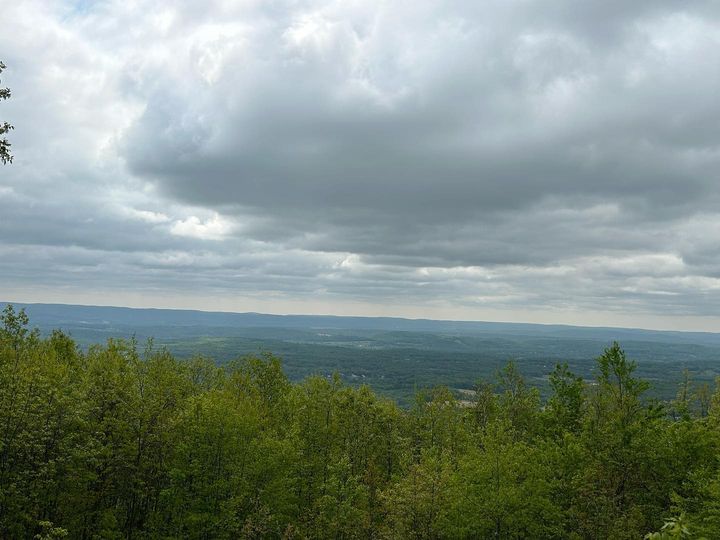
Identify the location of dust. Image resolution: width=720 pixels, height=540 pixels. (238, 305).